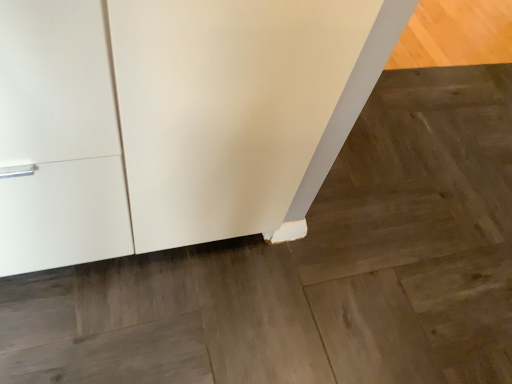
What do you see at coordinates (175, 119) in the screenshot? The image size is (512, 384). I see `matte white cupboard at lower left` at bounding box center [175, 119].

At what (x,y) coordinates should I click in order to perform the action: click on matte white cupboard at lower left. Please return your answer as a coordinate pair (x, y). The width and height of the screenshot is (512, 384). Looking at the image, I should click on (175, 119).

This screenshot has height=384, width=512. Identify the location of matte white cupboard at lower left. (175, 119).